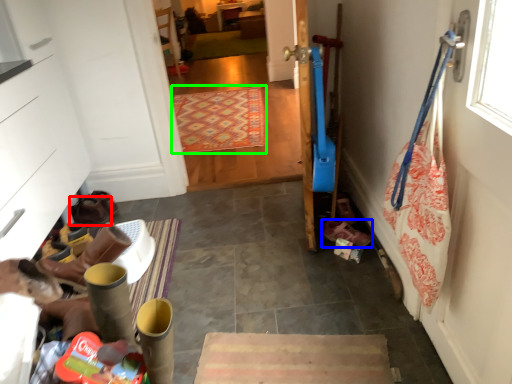
Question: Which is farther away from footwear (highlighted by a red box)? footwear (highlighted by a blue box) or mat (highlighted by a green box)?

Choices:
 (A) footwear
 (B) mat

Answer: (B)